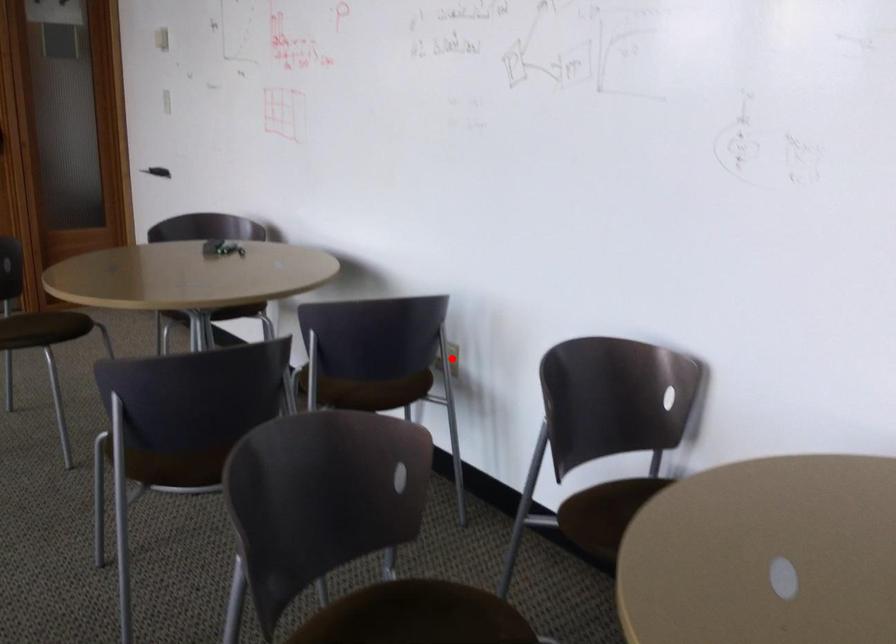
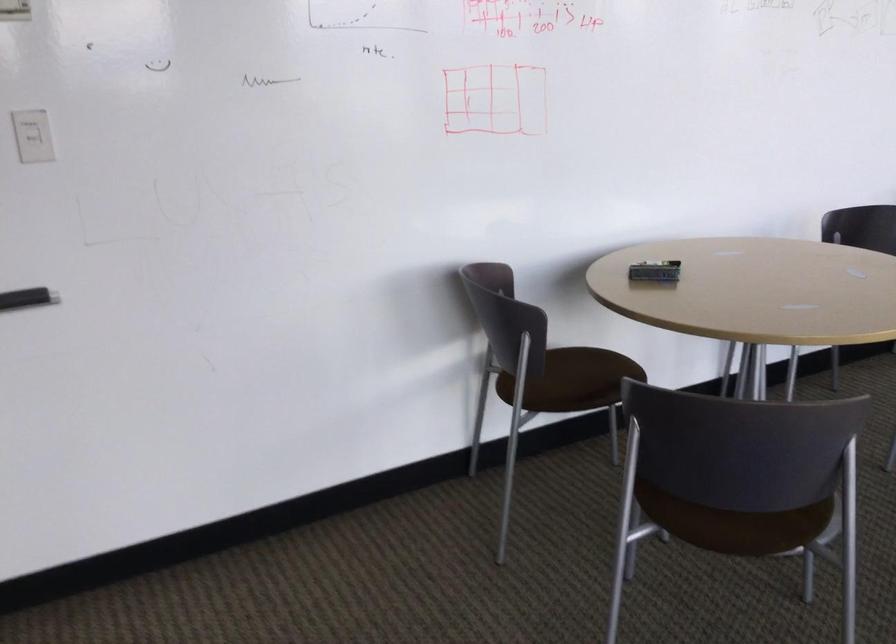
Question: I am providing you with two images of the same scene from different viewpoints. A red point is marked on the first image. Can you still see the location of the red point in image 2?

Choices:
 (A) Yes
 (B) No

Answer: (B)